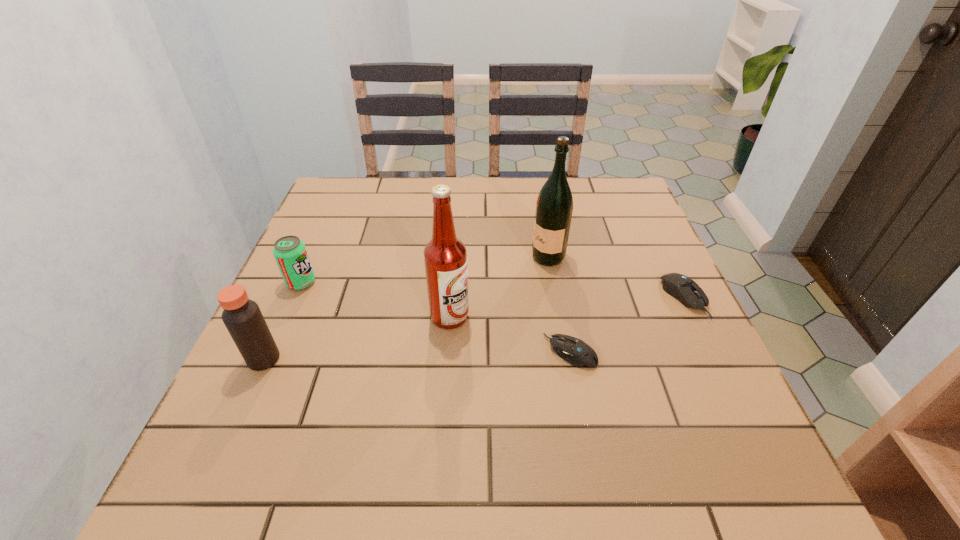
Identify the location of vacant area at the near edge of the desktop. This screenshot has width=960, height=540. (532, 434).

Locate an element on the screen. This screenshot has height=540, width=960. vacant area at the left edge is located at coordinates (329, 224).

Where is `free space at the far left corner of the desktop`? free space at the far left corner of the desktop is located at coordinates (348, 179).

Where is `vacant space at the near left corner of the desktop`? vacant space at the near left corner of the desktop is located at coordinates (254, 393).

What are the coordinates of `unoccupied position between the liquor and the farther computer mouse` in the screenshot? It's located at (616, 278).

This screenshot has width=960, height=540. Identify the location of free point between the vinegar and the farthest object. (406, 308).

What are the coordinates of `empty space between the farthest object and the pop soda` in the screenshot? It's located at (424, 270).

Find the location of `vacant area that lies between the farther computer mouse and the farthest object`. vacant area that lies between the farther computer mouse and the farthest object is located at coordinates (616, 278).

This screenshot has width=960, height=540. I want to click on free space between the pop soda and the third object from left to right, so click(375, 299).

The width and height of the screenshot is (960, 540). I want to click on free space between the shortest object and the fourth object from right to left, so click(510, 334).